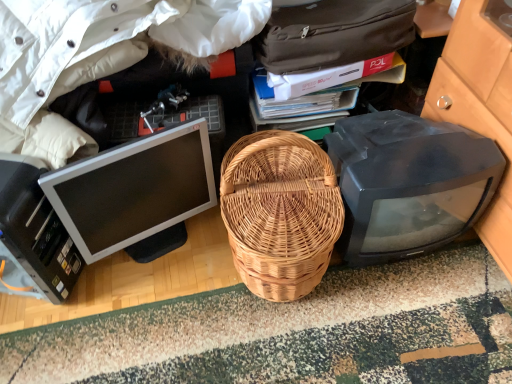
Question: Is black plastic printer at lower left inside the boundaries of white glossy computer monitor at left, the 1th computer monitor when ordered from left to right, or outside?

Choices:
 (A) outside
 (B) inside

Answer: (A)

Question: From a real-world perspective, is black plastic printer at lower left above or below white glossy computer monitor at left, arranged as the second computer monitor when viewed from the right?

Choices:
 (A) above
 (B) below

Answer: (A)

Question: Which object is the farthest from the black plastic printer at lower left?

Choices:
 (A) white cotton jacket at upper left
 (B) matte black monitor at right, the first computer monitor when ordered from right to left
 (C) white glossy computer monitor at left, the 1th computer monitor when ordered from left to right
 (D) natural wicker picnic basket at center

Answer: (B)

Question: Estimate the real-world distances between objects in this image. Which object is closer to the black plastic printer at lower left?

Choices:
 (A) matte black monitor at right, the first computer monitor when ordered from right to left
 (B) natural wicker picnic basket at center
 (C) white cotton jacket at upper left
 (D) white glossy computer monitor at left, arranged as the second computer monitor when viewed from the right

Answer: (D)